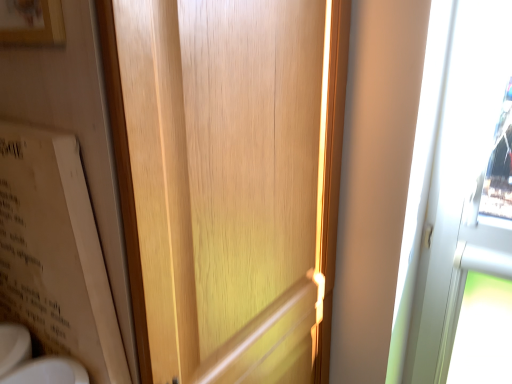
Question: Considering the positions of wooden door at center and white glossy sink at lower left in the image, is wooden door at center taller or shorter than white glossy sink at lower left?

Choices:
 (A) tall
 (B) short

Answer: (A)

Question: From a real-world perspective, is wooden door at center physically located above or below white glossy sink at lower left?

Choices:
 (A) below
 (B) above

Answer: (A)

Question: Based on their relative distances, which object is nearer to the wooden picture frame at upper left?

Choices:
 (A) beige cardboard bulletin board at left
 (B) white glossy sink at lower left
 (C) wooden door at center

Answer: (A)

Question: Which of these objects is positioned closest to the wooden picture frame at upper left?

Choices:
 (A) beige cardboard bulletin board at left
 (B) white glossy sink at lower left
 (C) wooden door at center

Answer: (A)